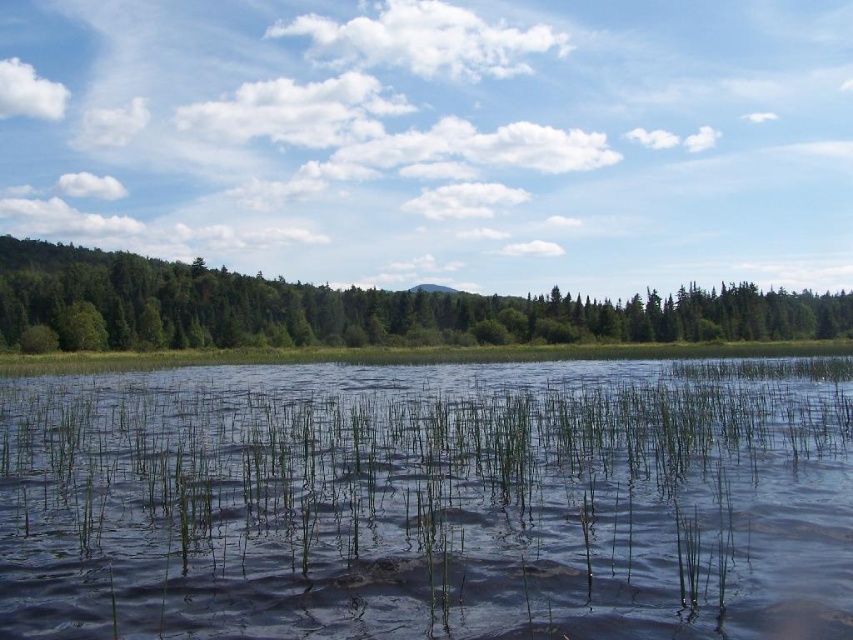
You are standing in the serene landscape and want to walk from the green matte tree at left to the green grassy water at center. Which direction should you head?

You should head to the right because the green grassy water at center is located to the left of the green matte tree at left, so moving right from the tree will lead you towards the water.

You are an environmental scientist studying the ecosystem in the image. You observe the green grassy water at center and the green matte tree at left. Which area would you prioritize for a biodiversity assessment, and why?

The green matte tree at left should be prioritized because it occupies more space than the green grassy water at center, indicating a potentially richer habitat for diverse species.